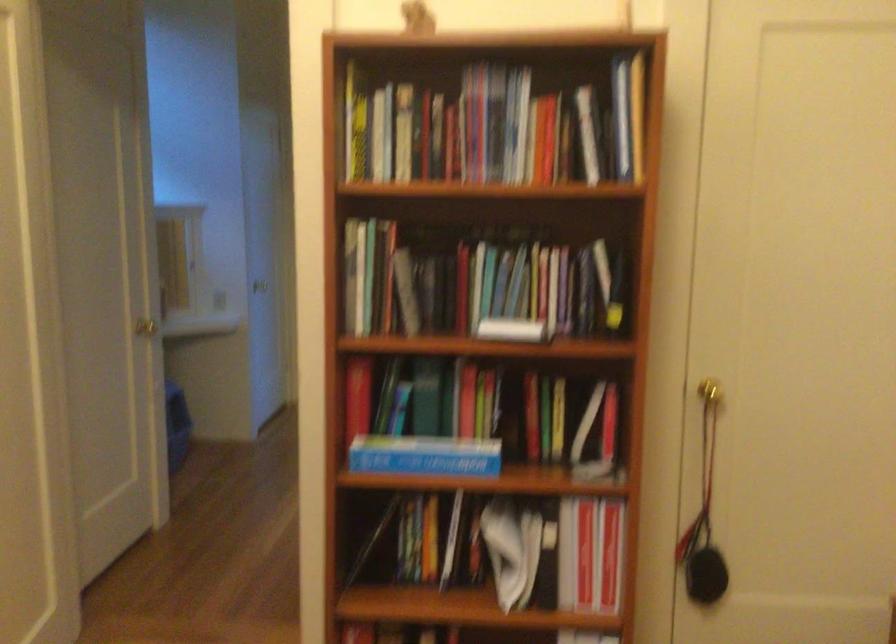
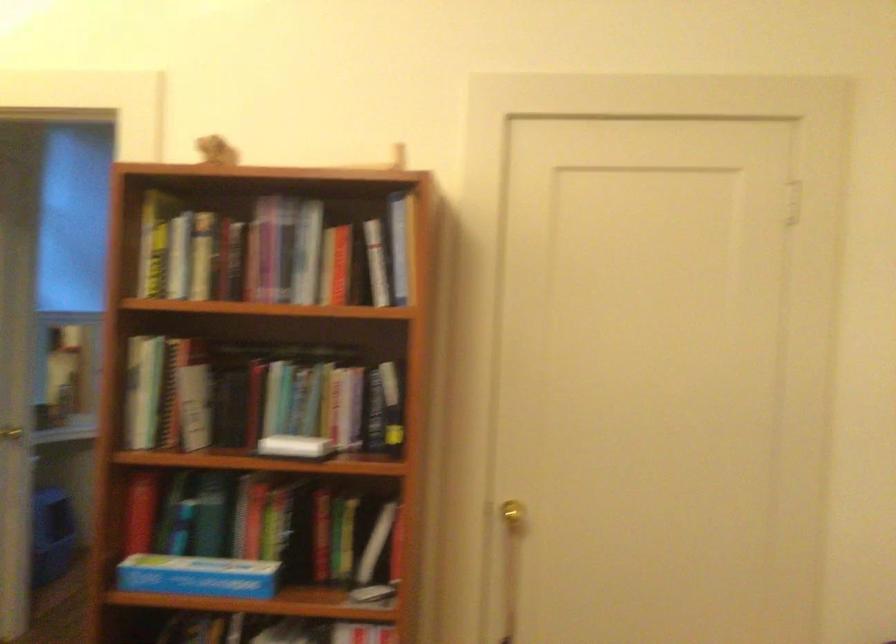
Question: The images are taken continuously from a first-person perspective. In which direction are you moving?

Choices:
 (A) Left
 (B) Right
 (C) Forward
 (D) Backward

Answer: (B)